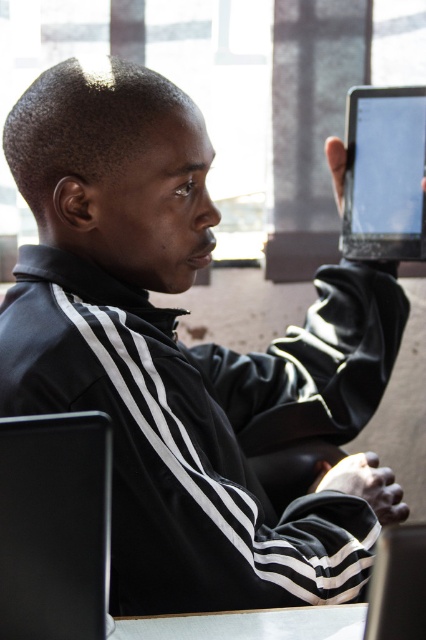
Which is below, black matte laptop at lower left or black glossy laptop at lower right?

black matte laptop at lower left is below.

Does black matte laptop at lower left have a lesser height compared to black glossy laptop at lower right?

No, black matte laptop at lower left is not shorter than black glossy laptop at lower right.

Does point (0, 547) lie behind point (382, 573)?

That is True.

Locate an element on the screen. black matte laptop at lower left is located at coordinates (54, 525).

Is black matte laptop at lower left shorter than white glossy table at lower center?

Incorrect, black matte laptop at lower left's height does not fall short of white glossy table at lower center's.

Where is `black matte laptop at lower left`? The image size is (426, 640). black matte laptop at lower left is located at coordinates pos(54,525).

At what (x,y) coordinates should I click in order to perform the action: click on black matte laptop at lower left. Please return your answer as a coordinate pair (x, y). This screenshot has width=426, height=640. Looking at the image, I should click on (54, 525).

Which of these two, black matte laptop at lower left or black glossy tablet at upper right, stands taller?

With more height is black glossy tablet at upper right.

Is point (92, 449) closer to viewer compared to point (402, 257)?

Yes, point (92, 449) is closer to viewer.

Locate an element on the screen. black matte laptop at lower left is located at coordinates (54, 525).